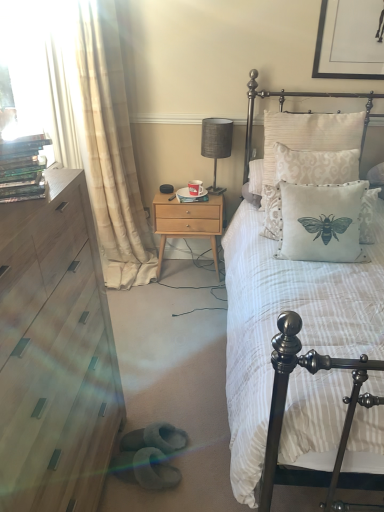
Question: From a real-world perspective, relative to silk-patterned pillow at upper right, is creamy beige fabric pillow at upper right, which is counted as the 2th pillow, starting from the bottom, vertically above or below?

Choices:
 (A) below
 (B) above

Answer: (B)

Question: Is point (299, 180) closer or farther from the camera than point (281, 103)?

Choices:
 (A) farther
 (B) closer

Answer: (B)

Question: Considering the real-world distances, which object is farthest from the transparent plastic dvds at left?

Choices:
 (A) white striped fabric bed at center
 (B) hardcover books at left
 (C) white fabric pillow with bee design at center, the first pillow ordered from the bottom
 (D) creamy beige fabric pillow at upper right, which is the first pillow from top to bottom
 (E) light wood/texture nightstand at center

Answer: (A)

Question: Estimate the real-world distances between objects in this image. Which object is closer to the light wood/texture nightstand at center?

Choices:
 (A) beige fabric curtain at left
 (B) light wood chest of drawers at left
 (C) white fabric pillow with bee design at center, the first pillow ordered from the bottom
 (D) transparent plastic dvds at left
 (E) silk-patterned pillow at upper right

Answer: (A)